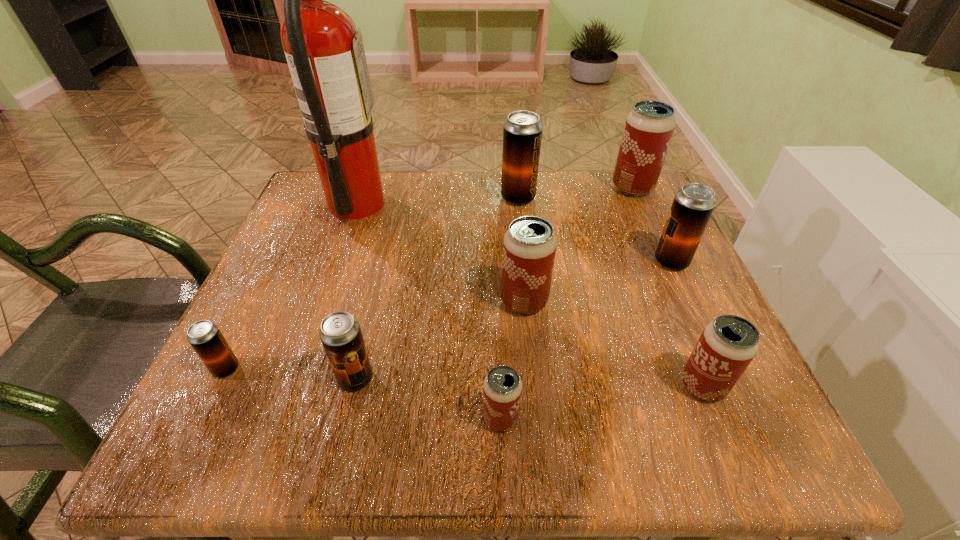
This screenshot has height=540, width=960. What are the coordinates of `the second beer can from left to right` in the screenshot? It's located at (340, 333).

Where is `the second smallest red beer can`? The image size is (960, 540). the second smallest red beer can is located at coordinates (728, 344).

At what (x,y) coordinates should I click in order to perform the action: click on the smallest black beer can. Please return your answer as a coordinate pair (x, y). Looking at the image, I should click on (206, 339).

This screenshot has width=960, height=540. I want to click on the leftmost black beer can, so click(206, 339).

The height and width of the screenshot is (540, 960). What are the coordinates of `the smallest red beer can` in the screenshot? It's located at (502, 393).

Where is `vacant space located 0.130m on the nozzle side of the red fire extinguisher`? This screenshot has width=960, height=540. vacant space located 0.130m on the nozzle side of the red fire extinguisher is located at coordinates (442, 204).

The image size is (960, 540). I want to click on blank space located 0.060m on the left of the biggest black beer can, so click(475, 198).

Locate an element on the screen. free space located on the left of the farthest red beer can is located at coordinates (468, 188).

Where is `free space located 0.260m on the left of the sixth nearest beer can`? This screenshot has width=960, height=540. free space located 0.260m on the left of the sixth nearest beer can is located at coordinates (524, 261).

Image resolution: width=960 pixels, height=540 pixels. What are the coordinates of `free location located 0.340m on the back of the third nearest red beer can` in the screenshot? It's located at (513, 186).